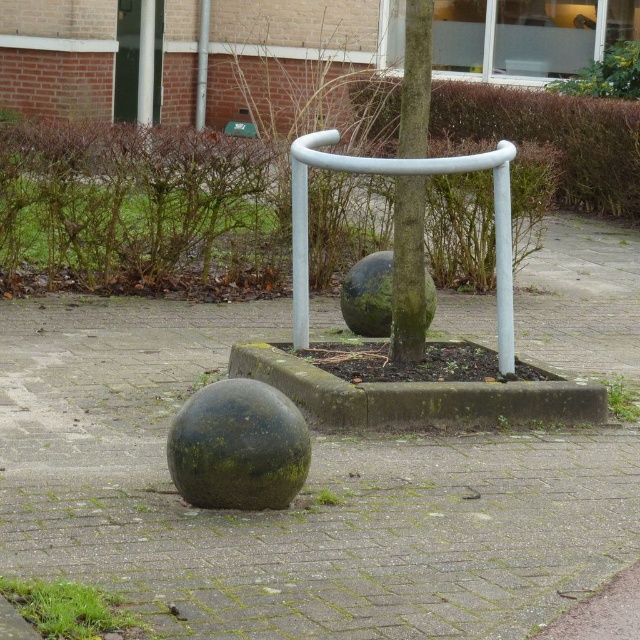
Question: Does green mossy sphere at lower left have a larger size compared to green mossy tree at center?

Choices:
 (A) no
 (B) yes

Answer: (B)

Question: Which point is farther from the camera taking this photo?

Choices:
 (A) (412, 227)
 (B) (275, 380)
 (C) (307, 136)
 (D) (378, 484)

Answer: (C)

Question: Can you confirm if green mossy sphere at lower left is positioned to the left of green mossy tree at center?

Choices:
 (A) yes
 (B) no

Answer: (A)

Question: Which point is closer to the camera?

Choices:
 (A) green mossy tree at center
 (B) green mossy sphere at lower left
 (C) green mossy concrete at center

Answer: (B)

Question: Which point is closer to the camera?

Choices:
 (A) green mossy tree at center
 (B) white matte rail at center

Answer: (B)

Question: Is the position of white matte rail at center more distant than that of green mossy tree at center?

Choices:
 (A) yes
 (B) no

Answer: (B)